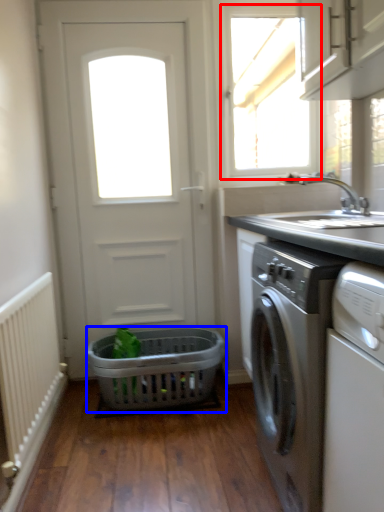
Question: Which object appears closest to the camera in this image, window (highlighted by a red box) or basket (highlighted by a blue box)?

Choices:
 (A) window
 (B) basket

Answer: (B)